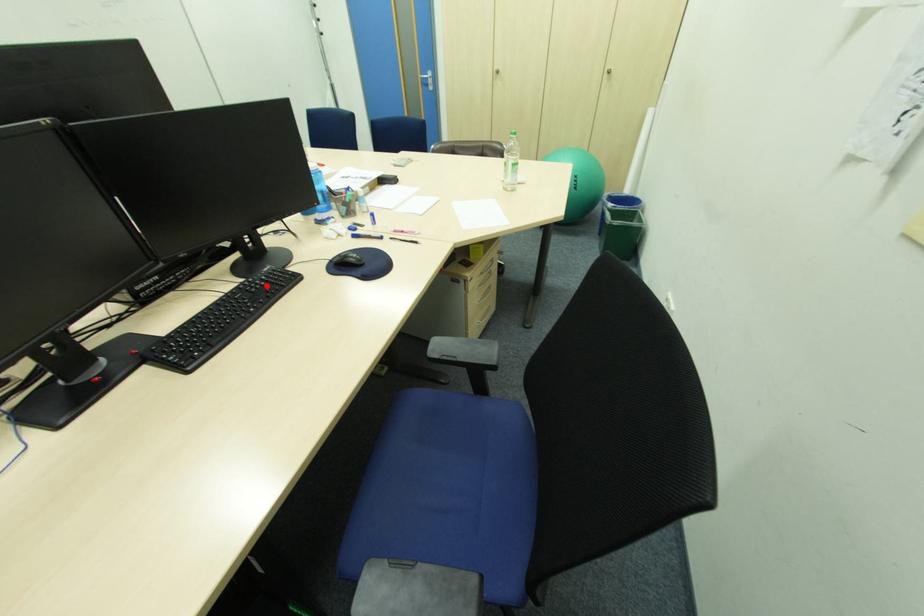
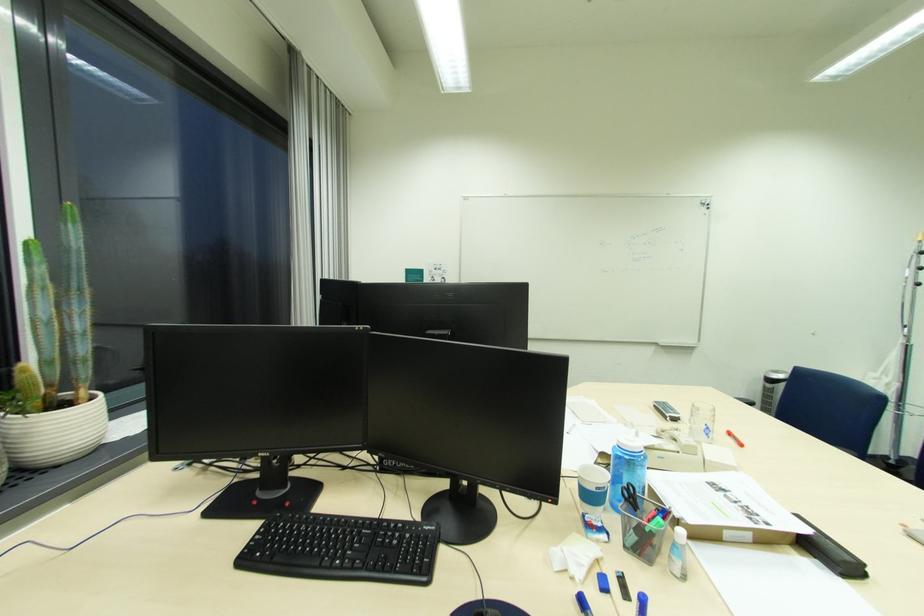
Where in the second image is the point corresponding to the highlighted location from the first image?

(396, 541)